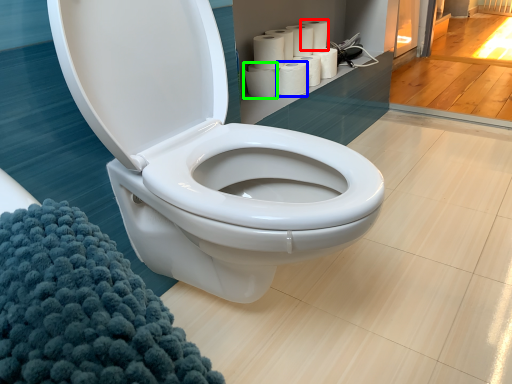
Question: Estimate the real-world distances between objects in this image. Which object is closer to toilet paper (highlighted by a red box), paper towel (highlighted by a blue box) or paper towel (highlighted by a green box)?

Choices:
 (A) paper towel
 (B) paper towel

Answer: (A)